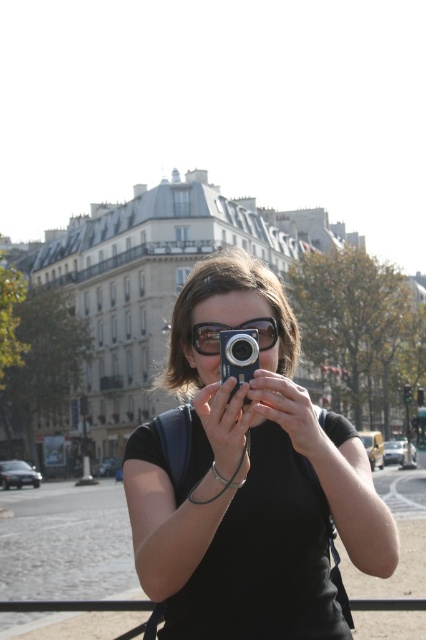
Can you confirm if metallic silver camera at center is smaller than sunglasses at center?

Actually, metallic silver camera at center might be larger than sunglasses at center.

Locate an element on the screen. metallic silver camera at center is located at coordinates (238, 355).

Can you confirm if matte black camera at center is positioned to the right of metallic silver camera at center?

Indeed, matte black camera at center is positioned on the right side of metallic silver camera at center.

Can you confirm if matte black camera at center is positioned above metallic silver camera at center?

No.

What do you see at coordinates (250, 483) in the screenshot?
I see `matte black camera at center` at bounding box center [250, 483].

What are the coordinates of `matte black camera at center` in the screenshot? It's located at (250, 483).

Can you confirm if matte black camera at center is positioned to the left of sunglasses at center?

No, matte black camera at center is not to the left of sunglasses at center.

Does point (230, 598) come farther from viewer compared to point (267, 333)?

No, (230, 598) is in front of (267, 333).

I want to click on matte black camera at center, so click(x=250, y=483).